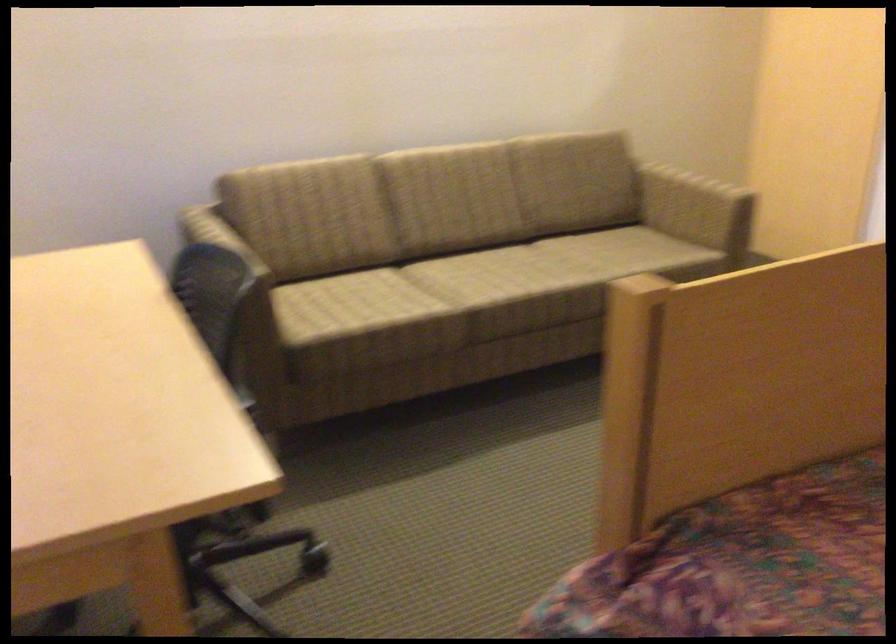
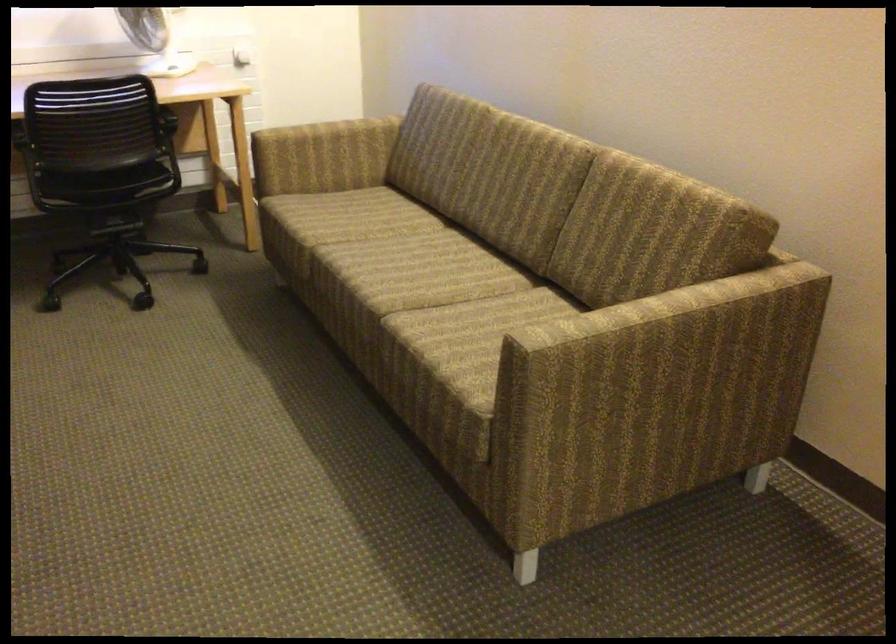
Locate, in the second image, the point that corresponds to pixel 690 216 in the first image.

(655, 393)